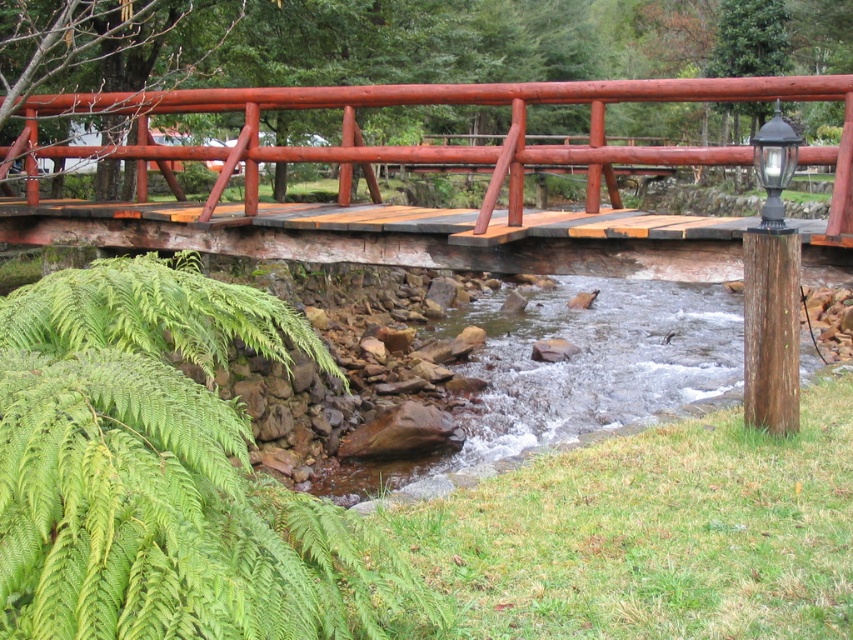
Question: Estimate the real-world distances between objects in this image. Which object is farther from the black polished wood post at right?

Choices:
 (A) rustic wood bridge at center
 (B) green leafy fern at lower left

Answer: (A)

Question: Which object appears closest to the camera in this image?

Choices:
 (A) green leafy fern at lower left
 (B) rustic wood bridge at center

Answer: (A)

Question: Is green leafy fern at lower left to the right of rustic wood bridge at center from the viewer's perspective?

Choices:
 (A) no
 (B) yes

Answer: (A)

Question: Which point is farther from the camera taking this photo?

Choices:
 (A) (28, 177)
 (B) (144, 499)

Answer: (A)

Question: Considering the relative positions of green leafy fern at lower left and rustic wood bridge at center in the image provided, where is green leafy fern at lower left located with respect to rustic wood bridge at center?

Choices:
 (A) left
 (B) right

Answer: (A)

Question: Does green leafy fern at lower left appear on the right side of black polished wood post at right?

Choices:
 (A) no
 (B) yes

Answer: (A)